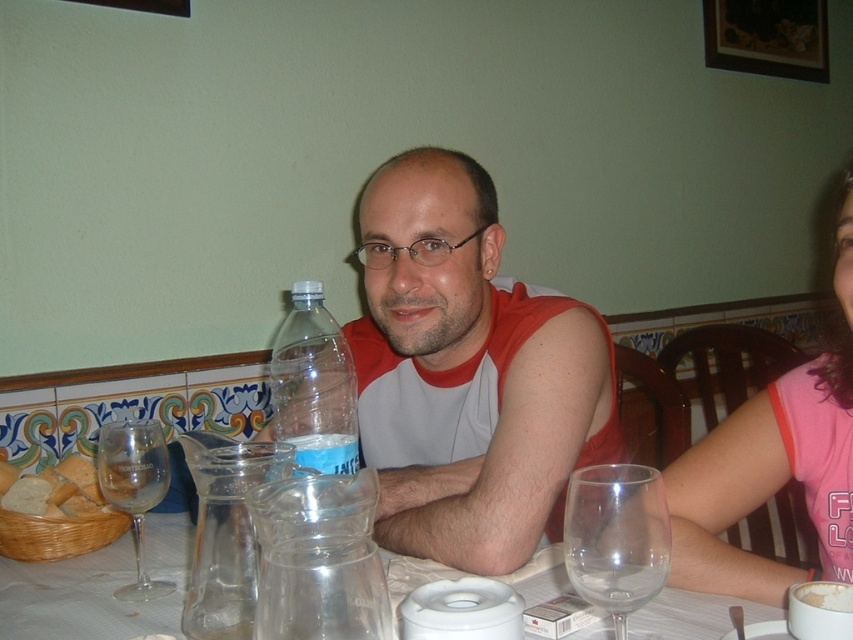
Question: Does transparent glass at center have a smaller size compared to transparent glass at lower right?

Choices:
 (A) yes
 (B) no

Answer: (B)

Question: Among these objects, which one is nearest to the camera?

Choices:
 (A) clear plastic bottle at center
 (B) clear glass wine glass at left

Answer: (A)

Question: Does matte plastic bottle at center appear on the right side of transparent glass at center?

Choices:
 (A) no
 (B) yes

Answer: (B)

Question: Does matte plastic bottle at center appear over pink fabric shirt at upper right?

Choices:
 (A) no
 (B) yes

Answer: (B)

Question: Among these objects, which one is farthest from the camera?

Choices:
 (A) clear plastic bottle at center
 (B) pink fabric shirt at upper right
 (C) clear glass wine glass at left
 (D) transparent glass at lower right

Answer: (C)

Question: Which point appears farthest from the camera in this image?

Choices:
 (A) (44, 593)
 (B) (612, 518)
 (C) (437, 536)

Answer: (C)